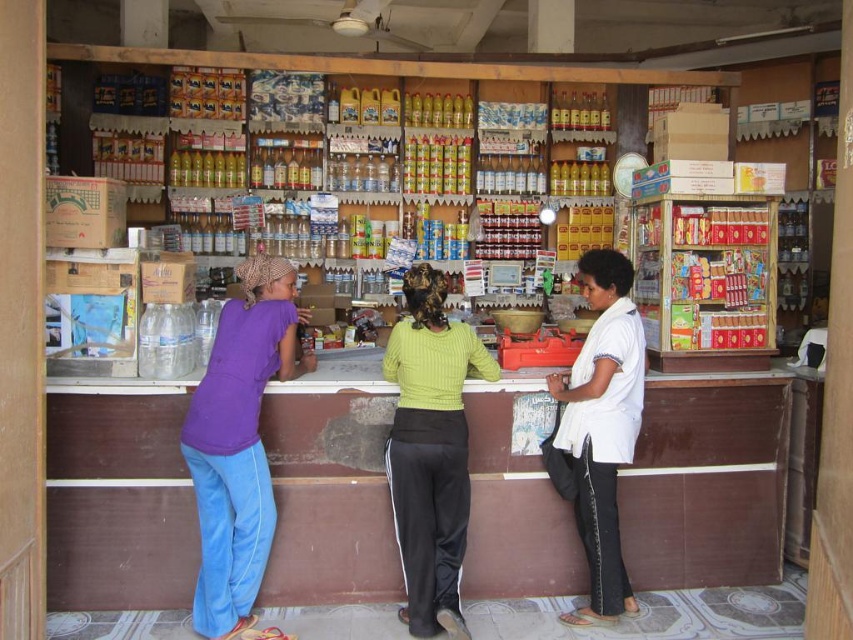
Who is positioned more to the right, ribbed green sweater at center or white cotton shirt at center?

white cotton shirt at center is more to the right.

Is the position of ribbed green sweater at center less distant than that of white cotton shirt at center?

Yes, ribbed green sweater at center is in front of white cotton shirt at center.

The height and width of the screenshot is (640, 853). What are the coordinates of `ribbed green sweater at center` in the screenshot? It's located at (430, 451).

Image resolution: width=853 pixels, height=640 pixels. I want to click on ribbed green sweater at center, so point(430,451).

The width and height of the screenshot is (853, 640). What do you see at coordinates (238, 442) in the screenshot?
I see `purple cotton shirt at left` at bounding box center [238, 442].

Does purple cotton shirt at left appear on the right side of ribbed green sweater at center?

In fact, purple cotton shirt at left is to the left of ribbed green sweater at center.

Does point (202, 406) lie in front of point (450, 541)?

Yes, it is in front of point (450, 541).

Locate an element on the screen. The height and width of the screenshot is (640, 853). purple cotton shirt at left is located at coordinates (238, 442).

Is point (233, 563) positioned in front of point (627, 337)?

Yes, it is in front of point (627, 337).

Is purple cotton shirt at left to the right of white cotton shirt at center from the viewer's perspective?

Incorrect, purple cotton shirt at left is not on the right side of white cotton shirt at center.

The height and width of the screenshot is (640, 853). I want to click on purple cotton shirt at left, so click(238, 442).

Identify the location of purple cotton shirt at left. (238, 442).